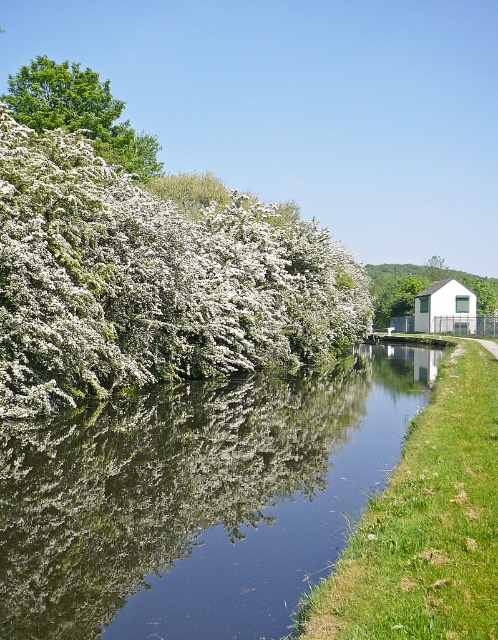
Is green leafy tree at upper left positioned in front of white matte house at right?

Yes, green leafy tree at upper left is closer to the viewer.

Can you confirm if green leafy tree at upper left is bigger than white matte house at right?

Yes.

Who is more forward, (x=40, y=61) or (x=443, y=282)?

Point (x=40, y=61) is more forward.

I want to click on green leafy tree at upper left, so click(80, 112).

Can you confirm if green reflective water at center is thinner than white matte house at right?

No.

Can you confirm if green reflective water at center is taller than white matte house at right?

Incorrect, green reflective water at center's height is not larger of white matte house at right's.

Does point (67, 442) lie in front of point (463, 326)?

Yes, it is.

The width and height of the screenshot is (498, 640). Identify the location of green reflective water at center. (196, 499).

Identify the location of white fluffy bush at left. (149, 280).

Find the location of a particular element. white fluffy bush at left is located at coordinates (149, 280).